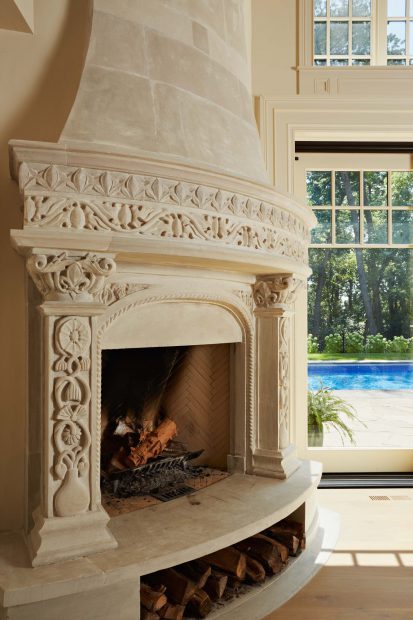
At what (x,y) coordinates should I click in order to perform the action: click on windows. Please return your answer as a coordinate pair (x, y). Looking at the image, I should click on (347, 36), (400, 31), (323, 188), (326, 227), (408, 177), (408, 226).